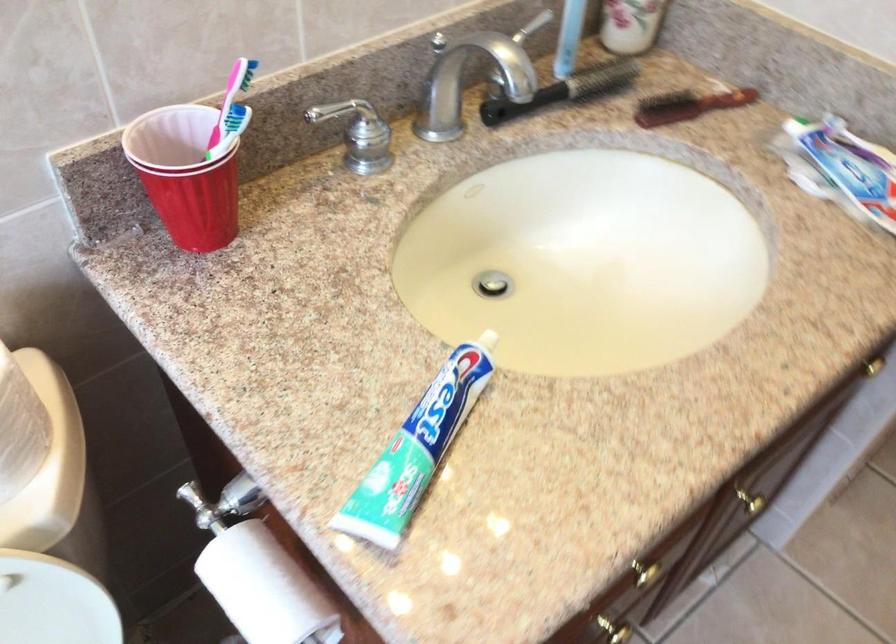
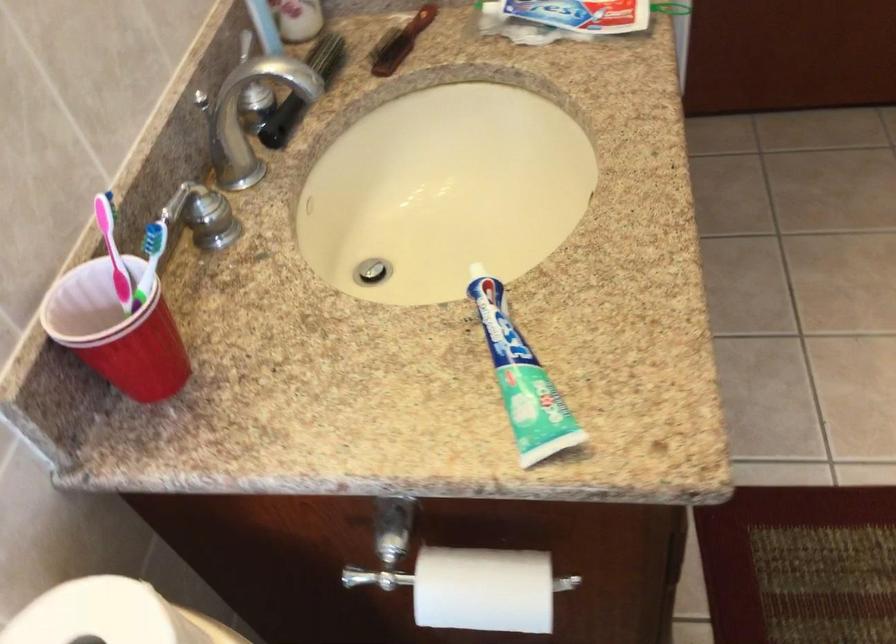
Question: I am providing you with two images of the same scene from different viewpoints. After the viewpoint changes to image2, which objects are now occluded?

Choices:
 (A) white toilet lid
 (B) sink drain lever
 (C) red toothpaste box
 (D) none of these

Answer: (D)